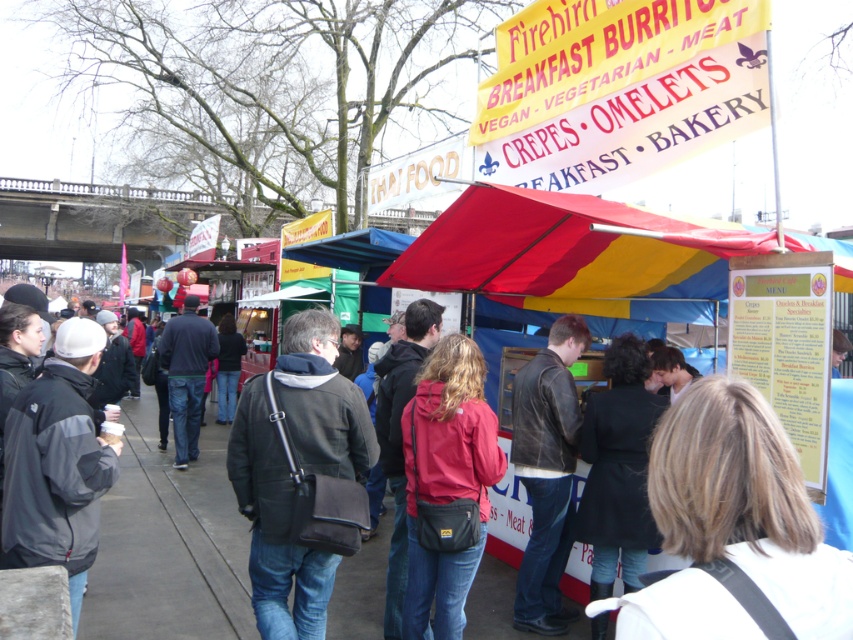
You are standing at the origin point of the image coordinate system. The dark gray leather jacket at center is located at point 0.823, 0.324. Can you determine if the jacket is positioned to the right or left of the center point of the image?

The dark gray leather jacket at center is located at point (276, 525). Since the x coordinate is 0.823 which is greater than 0.5, the jacket is positioned to the right of the center point of the image.

You are standing at the point marked as point (4, 452) in the market scene. A vendor is approaching you from the bridge in the background. If the vendor moves at a speed of 1.2 meters per second, how many seconds will it take for them to reach you?

The distance between point (4, 452) and the viewer is 3.99 meters. Since the vendor is moving at 1.2 meters per second, the time taken would be 3.99 divided by 1.2, which equals approximately 3.325 seconds. Therefore, it will take roughly 3.3 seconds for the vendor to reach you.